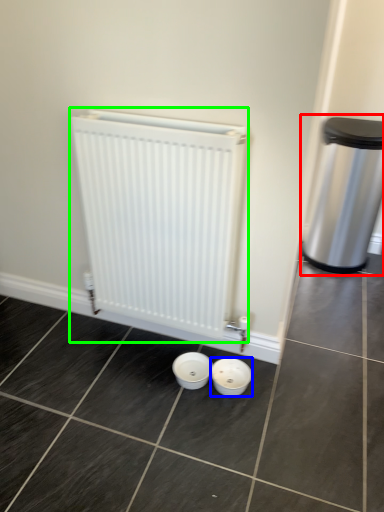
Question: Which object is positioned closest to waste container (highlighted by a red box)? Select from basin (highlighted by a blue box) and radiator (highlighted by a green box).

Choices:
 (A) basin
 (B) radiator

Answer: (B)